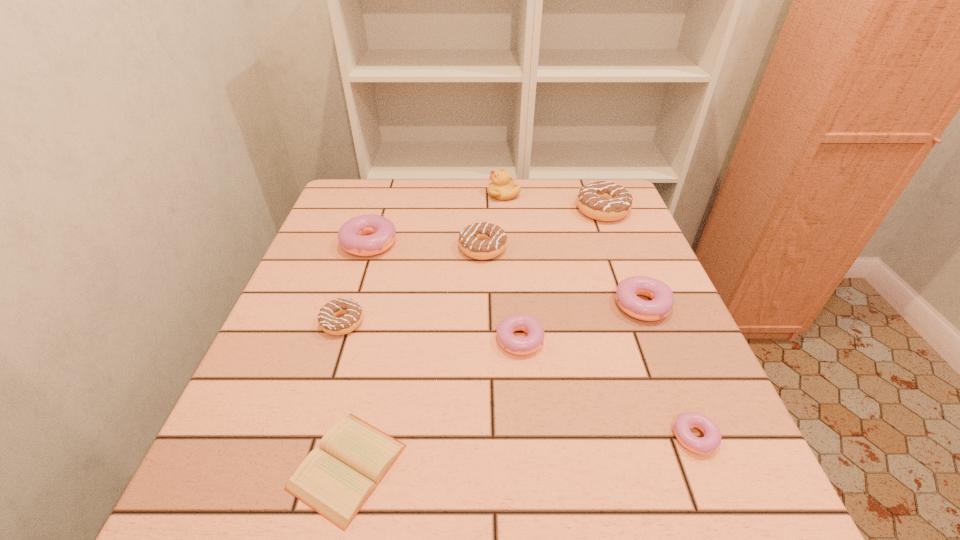
This screenshot has width=960, height=540. Identify the location of object that is at the near left corner. (335, 480).

Image resolution: width=960 pixels, height=540 pixels. What are the coordinates of `object present at the far right corner` in the screenshot? It's located at (600, 200).

At what (x,y) coordinates should I click in order to perform the action: click on blank space at the far edge. Please return your answer as a coordinate pair (x, y). Looking at the image, I should click on (530, 183).

This screenshot has width=960, height=540. In the image, there is a desktop. Find the location of `vacant space at the near edge`. vacant space at the near edge is located at coordinates (613, 516).

The image size is (960, 540). Find the location of `free space at the left edge of the desktop`. free space at the left edge of the desktop is located at coordinates (301, 333).

Where is `free region at the right edge of the desktop`? The height and width of the screenshot is (540, 960). free region at the right edge of the desktop is located at coordinates (671, 450).

Find the location of a particular element. This screenshot has height=540, width=960. free spot at the near left corner of the desktop is located at coordinates (274, 472).

What are the coordinates of `free space at the far right corner` in the screenshot? It's located at (569, 193).

Locate an element on the screen. free space at the near right corner of the desktop is located at coordinates (675, 499).

Where is `free space between the second chocolate doughnut from right to left and the third purple doughnut from right to left`? The image size is (960, 540). free space between the second chocolate doughnut from right to left and the third purple doughnut from right to left is located at coordinates (502, 295).